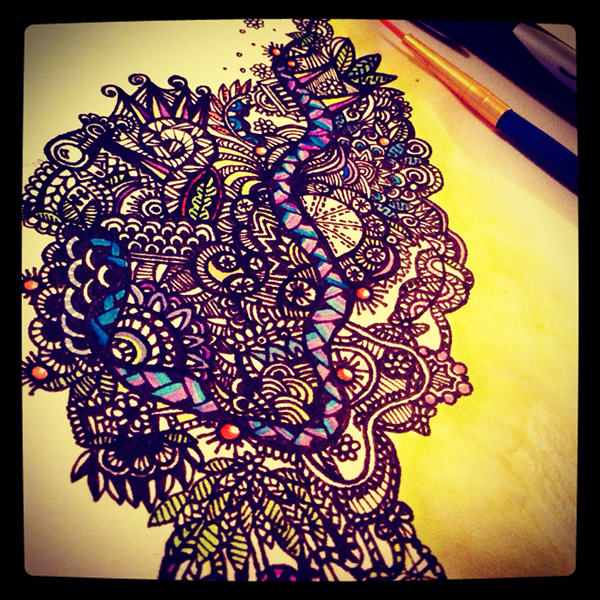
Locate an element on the screen. Image resolution: width=600 pixels, height=600 pixels. marker is located at coordinates (555, 46).